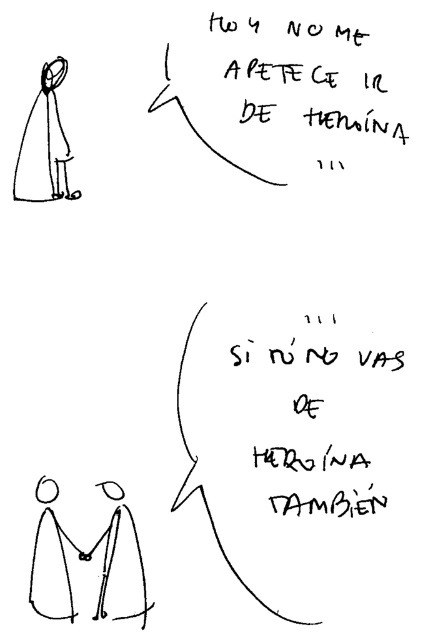
Which is in front, point (109, 552) or point (48, 106)?

Point (109, 552) is more forward.

Can you confirm if smooth black figures at center is positioned above black line drawing figure at upper left?

Incorrect, smooth black figures at center is not positioned above black line drawing figure at upper left.

Locate an element on the screen. This screenshot has height=640, width=433. smooth black figures at center is located at coordinates (87, 550).